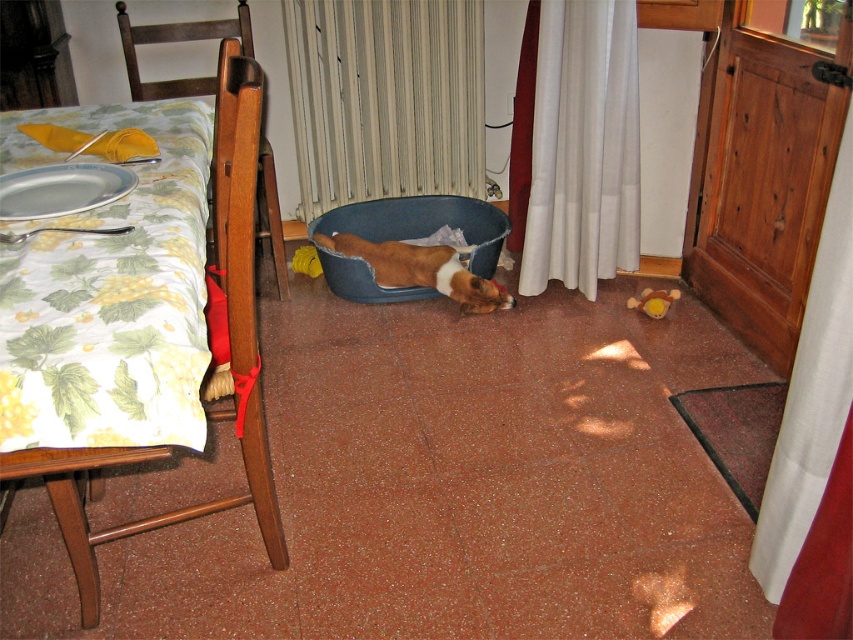
You are standing in the dining area and want to place a small plant pot between the two points marked as point (815,504) and point (850,500). Since the plant pot has a height of 15 cm, will it be visible from your current position?

Point (815,504) is further to the camera than point (850,500). The plant pot placed between them would be visible from your current position as the higher point is closer to you.

You are trying to decide which curtain to use to cover a large window. The white sheer curtain at lower right and the white fabric curtain at right are both options. Which one would you choose if you want the wider one to block more light?

The white sheer curtain at lower right is wider than the white fabric curtain at right, so it would be better to choose the white sheer curtain at lower right to block more light since it is wider.